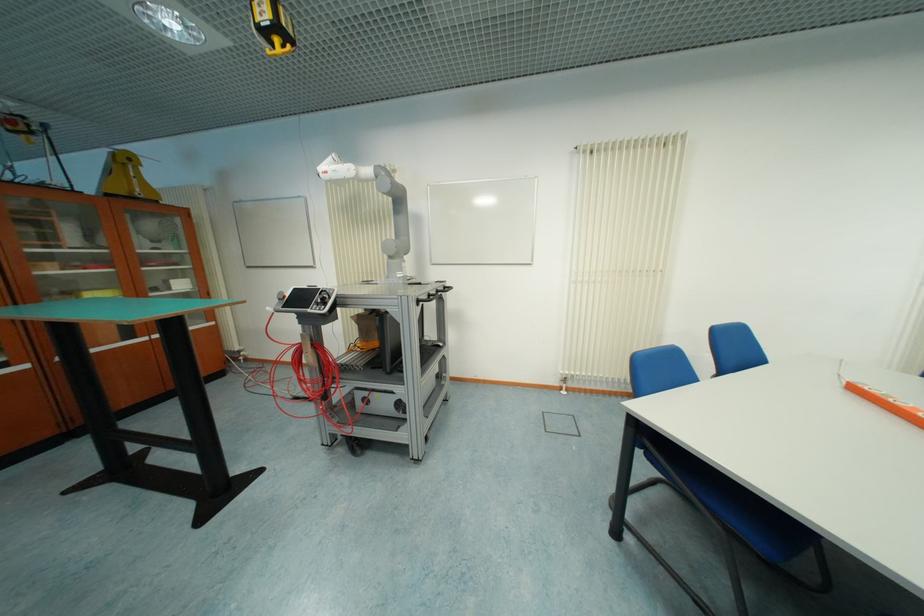
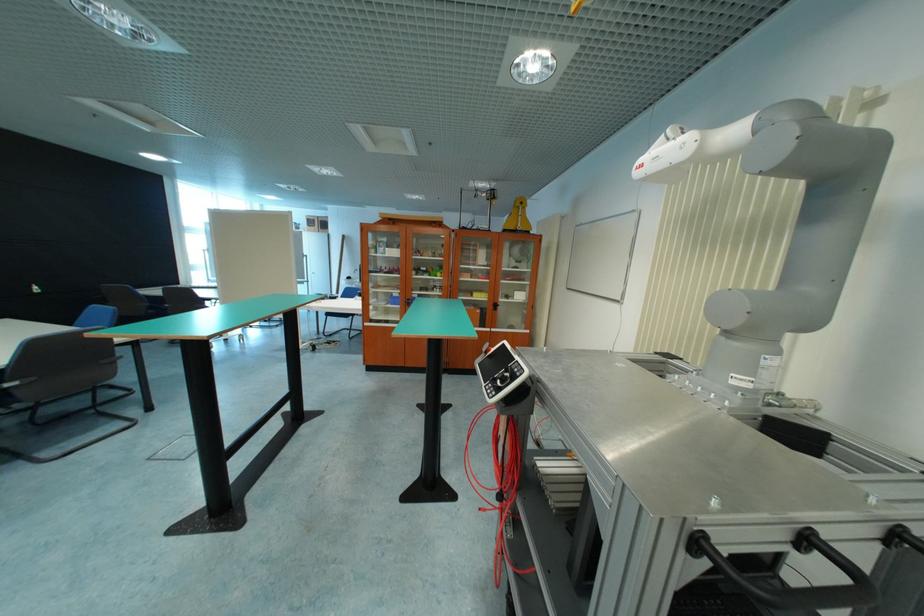
Question: How did the camera likely rotate?

Choices:
 (A) Left
 (B) Right
 (C) Up
 (D) Down

Answer: (A)